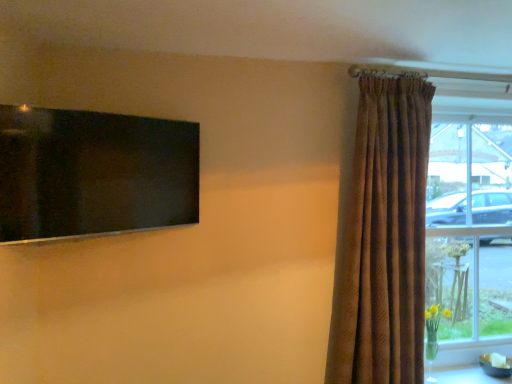
Question: Looking at the image, does white glossy table at lower right seem bigger or smaller compared to clear glass window at right?

Choices:
 (A) big
 (B) small

Answer: (B)

Question: Considering the positions of point (456, 382) and point (442, 200), is point (456, 382) closer or farther from the camera than point (442, 200)?

Choices:
 (A) closer
 (B) farther

Answer: (A)

Question: Considering the real-world distances, which object is closest to the black glossy screen at upper left?

Choices:
 (A) white glossy table at lower right
 (B) brown textured curtain at right
 (C) clear glass window at right

Answer: (B)

Question: Which of these objects is positioned closest to the brown textured curtain at right?

Choices:
 (A) clear glass window at right
 (B) black glossy screen at upper left
 (C) white glossy table at lower right

Answer: (A)